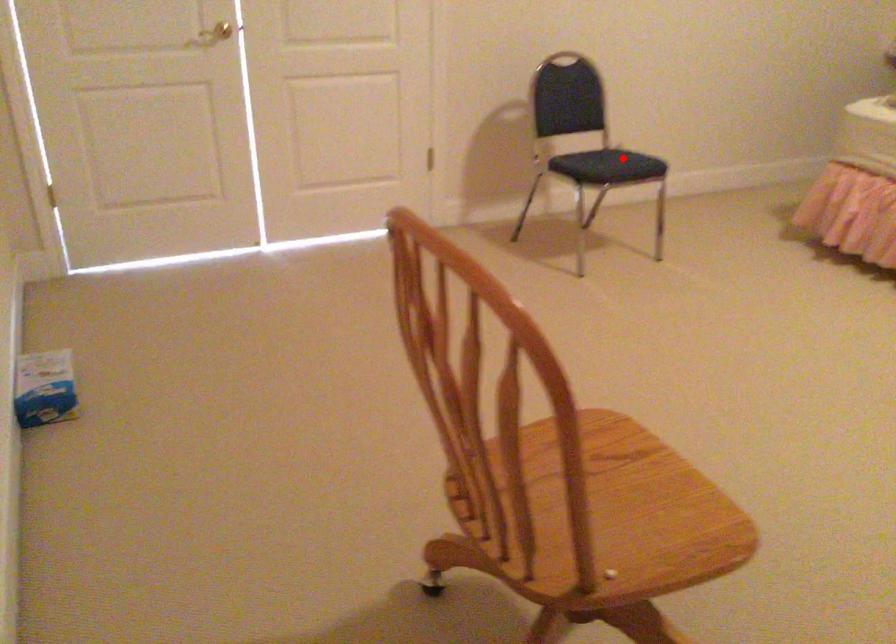
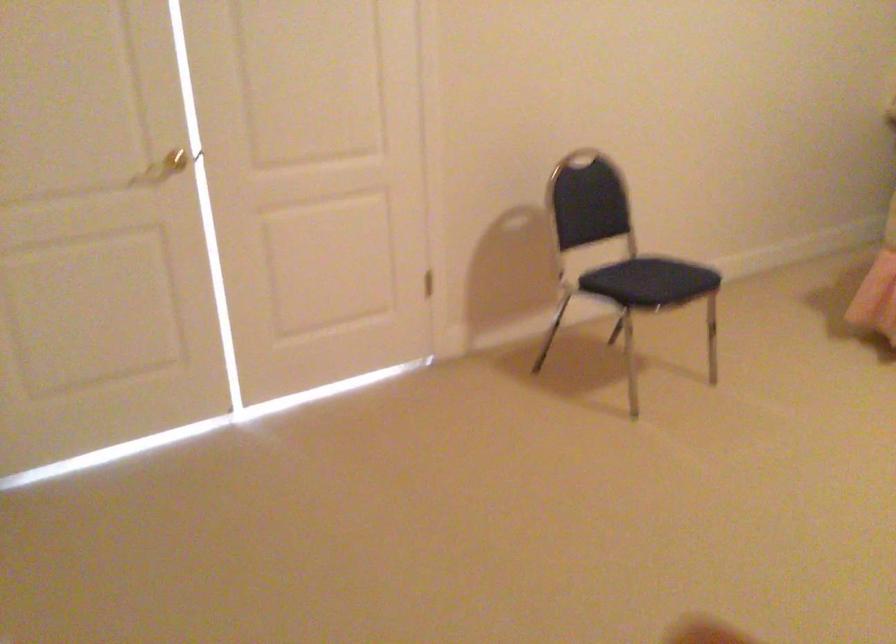
Find the pixel in the second image that matches the highlighted location in the first image.

(657, 276)